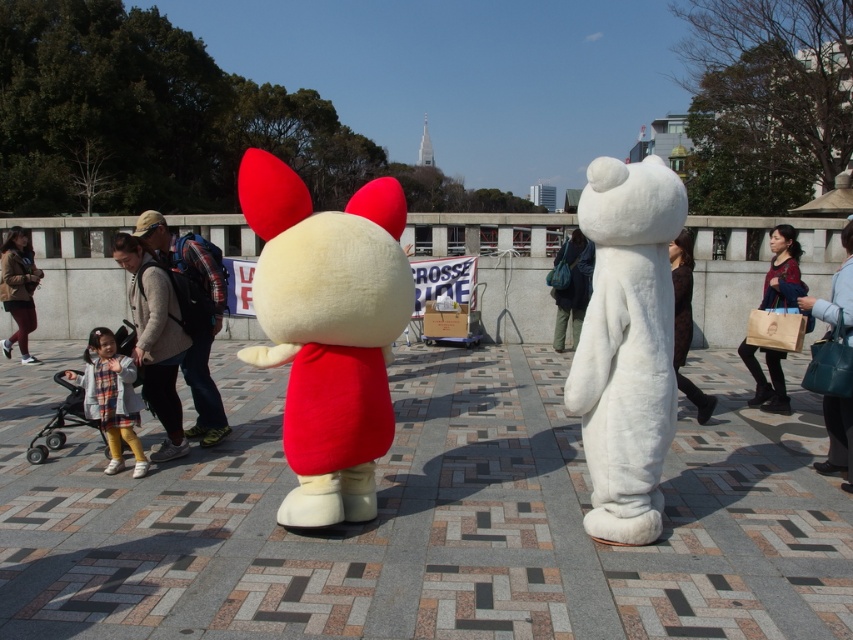
Question: Is white plush bear at right below matte red plush at center?

Choices:
 (A) yes
 (B) no

Answer: (B)

Question: Which point is farther from the camera taking this photo?

Choices:
 (A) (154, 276)
 (B) (204, 444)
 (C) (584, 308)

Answer: (C)

Question: Which point is closer to the camera taking this photo?

Choices:
 (A) coord(326,493)
 (B) coord(138,467)
 (C) coord(770,300)

Answer: (A)

Question: Which point is farther from the camera taking this photo?

Choices:
 (A) (167, 397)
 (B) (3, 349)
 (C) (601, 344)

Answer: (B)

Question: Can you confirm if fluffy white mascot at center is positioned to the right of matte brown paper bag at right?

Choices:
 (A) yes
 (B) no

Answer: (B)

Question: Does leather handbag at right lie behind velvet blue coat at center?

Choices:
 (A) no
 (B) yes

Answer: (A)